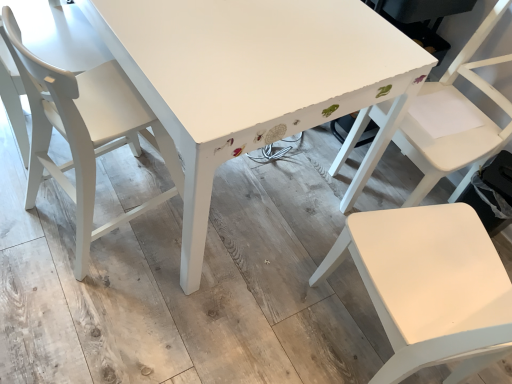
Question: Is white matte chair at center, the 1th chair when ordered from right to left, far away from white matte chair at right, marked as the 2th chair in a left-to-right arrangement?

Choices:
 (A) no
 (B) yes

Answer: (A)

Question: Could white matte chair at right, the 2th chair when ordered from right to left, be considered to be inside white matte chair at center, the 1th chair when ordered from right to left?

Choices:
 (A) yes
 (B) no

Answer: (B)

Question: Considering the relative sizes of white matte chair at center, the 1th chair when ordered from right to left, and white matte chair at right, marked as the 2th chair in a left-to-right arrangement, in the image provided, is white matte chair at center, the 1th chair when ordered from right to left, shorter than white matte chair at right, marked as the 2th chair in a left-to-right arrangement,?

Choices:
 (A) yes
 (B) no

Answer: (B)

Question: Considering the relative sizes of white matte chair at center, the 1th chair when ordered from right to left, and white matte chair at right, marked as the 2th chair in a left-to-right arrangement, in the image provided, is white matte chair at center, the 1th chair when ordered from right to left, bigger than white matte chair at right, marked as the 2th chair in a left-to-right arrangement,?

Choices:
 (A) no
 (B) yes

Answer: (A)

Question: From a real-world perspective, does white matte chair at center, which is counted as the 3th chair, starting from the left, stand above white matte chair at right, marked as the 2th chair in a left-to-right arrangement?

Choices:
 (A) yes
 (B) no

Answer: (B)

Question: Is white matte chair at center, the 1th chair when ordered from right to left, next to white matte chair at right, the 2th chair when ordered from right to left, and touching it?

Choices:
 (A) yes
 (B) no

Answer: (B)

Question: From the image's perspective, does white painted wood table at center appear lower than white matte chair at right, marked as the 2th chair in a left-to-right arrangement?

Choices:
 (A) no
 (B) yes

Answer: (A)

Question: Is white matte chair at right, the 2th chair when ordered from right to left, a part of white painted wood table at center?

Choices:
 (A) yes
 (B) no

Answer: (B)

Question: Does white painted wood table at center have a greater height compared to white matte chair at right, marked as the 2th chair in a left-to-right arrangement?

Choices:
 (A) no
 (B) yes

Answer: (A)

Question: Does white painted wood table at center turn towards white matte chair at right, marked as the 2th chair in a left-to-right arrangement?

Choices:
 (A) yes
 (B) no

Answer: (B)

Question: Is the depth of white painted wood table at center greater than that of white matte chair at right, the 2th chair when ordered from right to left?

Choices:
 (A) yes
 (B) no

Answer: (A)

Question: Is white painted wood table at center to the right of white matte chair at right, marked as the 2th chair in a left-to-right arrangement, from the viewer's perspective?

Choices:
 (A) yes
 (B) no

Answer: (B)

Question: Considering the relative sizes of white matte chair at right, the 2th chair when ordered from right to left, and white painted wood table at center in the image provided, is white matte chair at right, the 2th chair when ordered from right to left, smaller than white painted wood table at center?

Choices:
 (A) yes
 (B) no

Answer: (A)